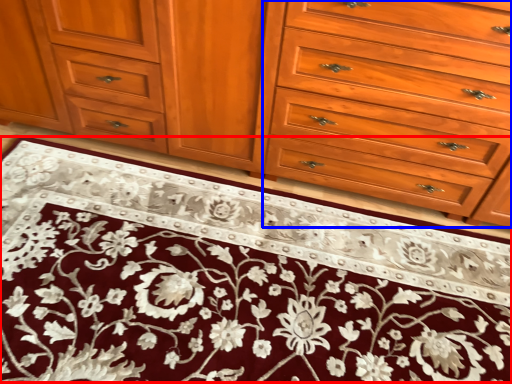
Question: Which object appears closest to the camera in this image, doormat (highlighted by a red box) or drawer (highlighted by a blue box)?

Choices:
 (A) doormat
 (B) drawer

Answer: (A)